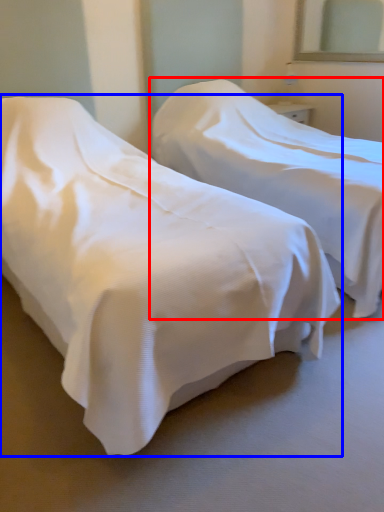
Question: Which object appears closest to the camera in this image, bed (highlighted by a red box) or bed (highlighted by a blue box)?

Choices:
 (A) bed
 (B) bed

Answer: (B)